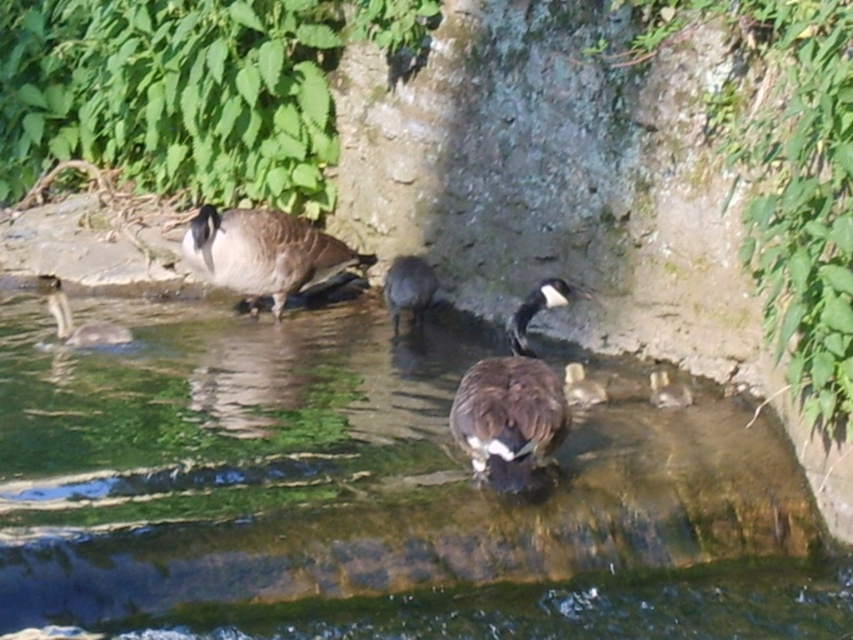
Is brown matte goose at center below brown matte duck at center?

Incorrect, brown matte goose at center is not positioned below brown matte duck at center.

This screenshot has width=853, height=640. What do you see at coordinates (263, 252) in the screenshot? I see `brown matte goose at center` at bounding box center [263, 252].

You are a GUI agent. You are given a task and a screenshot of the screen. Output one action in this format:
    pyautogui.click(x=<x>, y=<y>)
    Task: Click on the brown matte goose at center
    The height and width of the screenshot is (640, 853).
    Given the screenshot: What is the action you would take?
    pyautogui.click(x=263, y=252)

Is clear water at center below brown matte duck at center?

Yes, clear water at center is below brown matte duck at center.

Between clear water at center and brown matte duck at center, which one has less height?

With less height is brown matte duck at center.

Where is `clear water at center`? This screenshot has height=640, width=853. clear water at center is located at coordinates (373, 492).

Measure the distance between brown feathered duckling at lower left and brown fuzzy duckling at lower right.

A distance of 8.27 feet exists between brown feathered duckling at lower left and brown fuzzy duckling at lower right.

Who is more forward, (62, 300) or (653, 376)?

Point (653, 376) is more forward.

I want to click on brown feathered duckling at lower left, so click(83, 324).